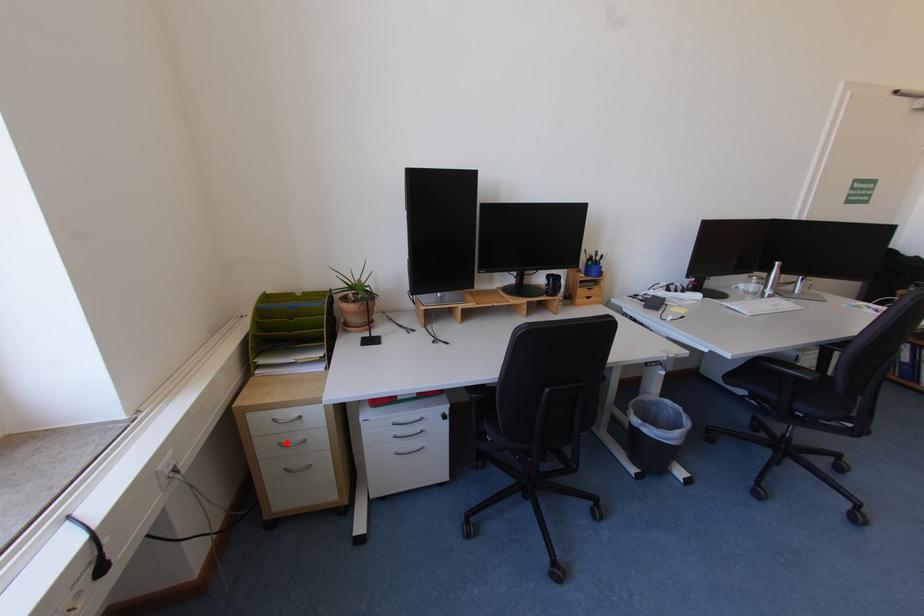
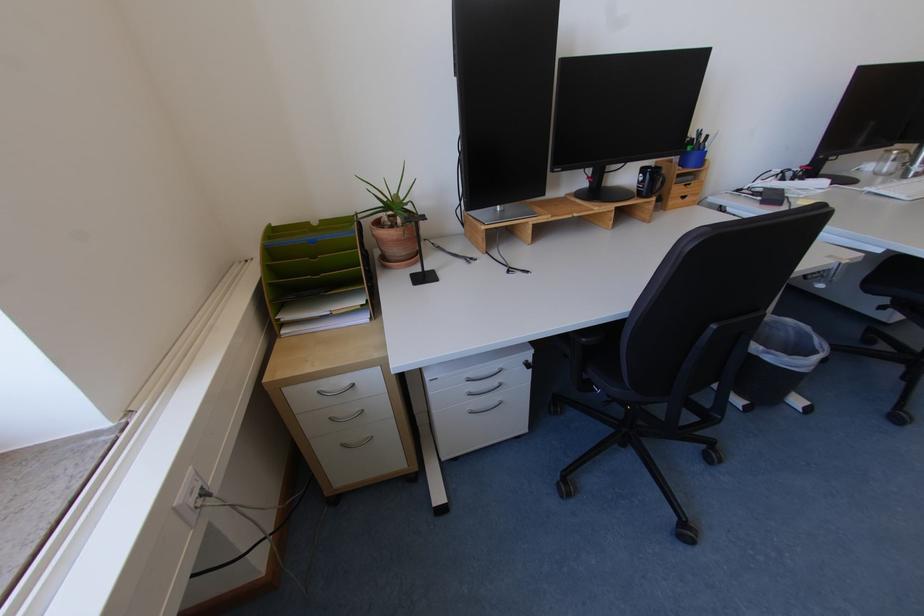
Where in the second image is the point corresponding to the highlighted location from the first image?

(337, 416)